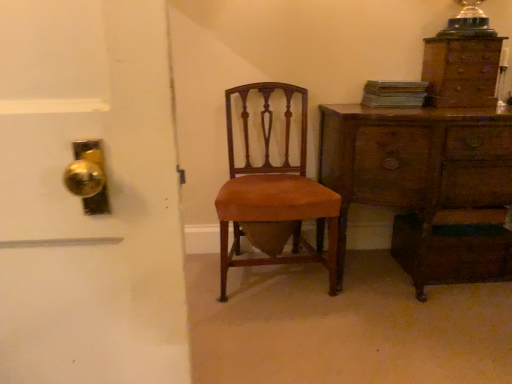
You are a GUI agent. You are given a task and a screenshot of the screen. Output one action in this format:
    pyautogui.click(x=<x>, y=<y>)
    Task: Click on the wooden chest of drawers at right, placed as the second chest of drawers when sorted from top to bottom
    Image resolution: width=512 pixels, height=384 pixels.
    Given the screenshot: What is the action you would take?
    pyautogui.click(x=417, y=167)

Identify the location of brown wood chair at center. (274, 195).

You are a GUI agent. You are given a task and a screenshot of the screen. Output one action in this format:
    pyautogui.click(x=<x>, y=<y>)
    Task: Click on the wooden chest of drawers at upper right, acting as the 2th chest of drawers starting from the bottom
    
    Given the screenshot: What is the action you would take?
    point(461,71)

Is brown wood chair at center oriented away from wooden chest of drawers at right, placed as the second chest of drawers when sorted from top to bottom?

brown wood chair at center is not turned away from wooden chest of drawers at right, placed as the second chest of drawers when sorted from top to bottom.

What's the angular difference between brown wood chair at center and wooden chest of drawers at right, placed as the second chest of drawers when sorted from top to bottom,'s facing directions?

There is a 0.0948-degree angle between the facing directions of brown wood chair at center and wooden chest of drawers at right, placed as the second chest of drawers when sorted from top to bottom.

Which is behind, point (321, 211) or point (374, 147)?

The point (321, 211) is farther.

From the image's perspective, is brown wood chair at center located above or below wooden chest of drawers at right, the first chest of drawers positioned from the bottom?

From the image's perspective, brown wood chair at center appears above wooden chest of drawers at right, the first chest of drawers positioned from the bottom.

How much distance is there between wooden chest of drawers at upper right, acting as the 2th chest of drawers starting from the bottom, and wooden chest of drawers at right, the first chest of drawers positioned from the bottom?

wooden chest of drawers at upper right, acting as the 2th chest of drawers starting from the bottom, is 35.19 centimeters from wooden chest of drawers at right, the first chest of drawers positioned from the bottom.

Is wooden chest of drawers at upper right, acting as the 2th chest of drawers starting from the bottom, positioned with its back to wooden chest of drawers at right, the first chest of drawers positioned from the bottom?

That's not correct — wooden chest of drawers at upper right, acting as the 2th chest of drawers starting from the bottom, is not looking away from wooden chest of drawers at right, the first chest of drawers positioned from the bottom.

Looking at the image, does wooden chest of drawers at upper right, acting as the 2th chest of drawers starting from the bottom, seem bigger or smaller compared to wooden chest of drawers at right, the first chest of drawers positioned from the bottom?

Clearly, wooden chest of drawers at upper right, acting as the 2th chest of drawers starting from the bottom, is smaller in size than wooden chest of drawers at right, the first chest of drawers positioned from the bottom.

Is wooden chest of drawers at upper right, acting as the 2th chest of drawers starting from the bottom, not close to wooden chest of drawers at right, the first chest of drawers positioned from the bottom?

wooden chest of drawers at upper right, acting as the 2th chest of drawers starting from the bottom, is near wooden chest of drawers at right, the first chest of drawers positioned from the bottom, not far away.

Is the depth of brown wood chair at center greater than that of translucent glass lampshade at upper right?

No, it is in front of translucent glass lampshade at upper right.

Is brown wood chair at center wider than translucent glass lampshade at upper right?

Yes.

From the image's perspective, would you say brown wood chair at center is shown under translucent glass lampshade at upper right?

Yes.

What are the coordinates of `table lamp above the brown wood chair at center (from a real-world perspective)` in the screenshot? It's located at (468, 22).

Can you confirm if wooden chest of drawers at right, the first chest of drawers positioned from the bottom, is wider than translucent glass lampshade at upper right?

Indeed, wooden chest of drawers at right, the first chest of drawers positioned from the bottom, has a greater width compared to translucent glass lampshade at upper right.

Is wooden chest of drawers at right, the first chest of drawers positioned from the bottom, oriented towards translucent glass lampshade at upper right?

No.

Does wooden chest of drawers at right, the first chest of drawers positioned from the bottom, have a larger size compared to translucent glass lampshade at upper right?

Yes.

What's the angular difference between wooden chest of drawers at right, placed as the second chest of drawers when sorted from top to bottom, and translucent glass lampshade at upper right's facing directions?

The facing directions of wooden chest of drawers at right, placed as the second chest of drawers when sorted from top to bottom, and translucent glass lampshade at upper right are 1.01 degrees apart.

Is translucent glass lampshade at upper right not inside wooden chest of drawers at upper right, acting as the 2th chest of drawers starting from the bottom?

Yes, translucent glass lampshade at upper right is outside of wooden chest of drawers at upper right, acting as the 2th chest of drawers starting from the bottom.

Considering the sizes of translucent glass lampshade at upper right and wooden chest of drawers at upper right, acting as the 2th chest of drawers starting from the bottom, in the image, is translucent glass lampshade at upper right wider or thinner than wooden chest of drawers at upper right, acting as the 2th chest of drawers starting from the bottom,?

translucent glass lampshade at upper right is thinner than wooden chest of drawers at upper right, acting as the 2th chest of drawers starting from the bottom.

Considering the relative positions of translucent glass lampshade at upper right and wooden chest of drawers at upper right, which appears as the first chest of drawers when viewed from the top, in the image provided, is translucent glass lampshade at upper right to the left of wooden chest of drawers at upper right, which appears as the first chest of drawers when viewed from the top, from the viewer's perspective?

Correct, you'll find translucent glass lampshade at upper right to the left of wooden chest of drawers at upper right, which appears as the first chest of drawers when viewed from the top.

How far apart are brown wood chair at center and wooden chest of drawers at upper right, acting as the 2th chest of drawers starting from the bottom?

The distance of brown wood chair at center from wooden chest of drawers at upper right, acting as the 2th chest of drawers starting from the bottom, is 82.13 centimeters.

Is brown wood chair at center inside the boundaries of wooden chest of drawers at upper right, acting as the 2th chest of drawers starting from the bottom, or outside?

brown wood chair at center is not inside wooden chest of drawers at upper right, acting as the 2th chest of drawers starting from the bottom, it's outside.

From a real-world perspective, is brown wood chair at center positioned under wooden chest of drawers at upper right, which appears as the first chest of drawers when viewed from the top, based on gravity?

Yes, from a real-world perspective, brown wood chair at center is below wooden chest of drawers at upper right, which appears as the first chest of drawers when viewed from the top.

From the brown wood chair at center, count 2nd chest of drawers to the right and point to it. Please provide its 2D coordinates.

[(461, 71)]

From the image's perspective, is wooden chest of drawers at upper right, acting as the 2th chest of drawers starting from the bottom, on brown wood chair at center?

Yes.

Is wooden chest of drawers at upper right, which appears as the first chest of drawers when viewed from the top, closer to the viewer compared to brown wood chair at center?

No, wooden chest of drawers at upper right, which appears as the first chest of drawers when viewed from the top, is behind brown wood chair at center.

Which of these two, wooden chest of drawers at upper right, which appears as the first chest of drawers when viewed from the top, or brown wood chair at center, is smaller?

Smaller between the two is wooden chest of drawers at upper right, which appears as the first chest of drawers when viewed from the top.

From the picture: Is brown wood chair at center at the back of wooden chest of drawers at upper right, which appears as the first chest of drawers when viewed from the top?

No, wooden chest of drawers at upper right, which appears as the first chest of drawers when viewed from the top,'s orientation is not away from brown wood chair at center.

Where is `chest of drawers below the brown wood chair at center (from a real-world perspective)`? The image size is (512, 384). chest of drawers below the brown wood chair at center (from a real-world perspective) is located at coordinates (417, 167).

This screenshot has height=384, width=512. Identify the location of chest of drawers above the wooden chest of drawers at right, placed as the second chest of drawers when sorted from top to bottom (from the image's perspective). (461, 71).

Estimate the real-world distances between objects in this image. Which object is closer to wooden chest of drawers at upper right, which appears as the first chest of drawers when viewed from the top, wooden chest of drawers at right, placed as the second chest of drawers when sorted from top to bottom, or brown wood chair at center?

wooden chest of drawers at right, placed as the second chest of drawers when sorted from top to bottom, lies closer to wooden chest of drawers at upper right, which appears as the first chest of drawers when viewed from the top, than the other object.

When comparing their distances from wooden chest of drawers at right, the first chest of drawers positioned from the bottom, does brown wood chair at center or translucent glass lampshade at upper right seem closer?

The object closer to wooden chest of drawers at right, the first chest of drawers positioned from the bottom, is brown wood chair at center.

Looking at the image, which one is located further to wooden chest of drawers at right, the first chest of drawers positioned from the bottom, brown wood chair at center or wooden chest of drawers at upper right, which appears as the first chest of drawers when viewed from the top?

wooden chest of drawers at upper right, which appears as the first chest of drawers when viewed from the top, is further to wooden chest of drawers at right, the first chest of drawers positioned from the bottom.

Which object lies further to the anchor point wooden chest of drawers at right, placed as the second chest of drawers when sorted from top to bottom, wooden chest of drawers at upper right, which appears as the first chest of drawers when viewed from the top, or translucent glass lampshade at upper right?

Among the two, translucent glass lampshade at upper right is located further to wooden chest of drawers at right, placed as the second chest of drawers when sorted from top to bottom.

Looking at the image, which one is located closer to translucent glass lampshade at upper right, wooden chest of drawers at right, placed as the second chest of drawers when sorted from top to bottom, or wooden chest of drawers at upper right, acting as the 2th chest of drawers starting from the bottom?

wooden chest of drawers at upper right, acting as the 2th chest of drawers starting from the bottom.

From the image, which object appears to be nearer to wooden chest of drawers at upper right, which appears as the first chest of drawers when viewed from the top, wooden chest of drawers at right, the first chest of drawers positioned from the bottom, or translucent glass lampshade at upper right?

translucent glass lampshade at upper right is closer to wooden chest of drawers at upper right, which appears as the first chest of drawers when viewed from the top.

Looking at the image, which one is located closer to brown wood chair at center, translucent glass lampshade at upper right or wooden chest of drawers at right, placed as the second chest of drawers when sorted from top to bottom?

wooden chest of drawers at right, placed as the second chest of drawers when sorted from top to bottom.

From the image, which object appears to be farther from wooden chest of drawers at right, the first chest of drawers positioned from the bottom, translucent glass lampshade at upper right or wooden chest of drawers at upper right, acting as the 2th chest of drawers starting from the bottom?

translucent glass lampshade at upper right is further to wooden chest of drawers at right, the first chest of drawers positioned from the bottom.

The height and width of the screenshot is (384, 512). Find the location of `table lamp located between brown wood chair at center and wooden chest of drawers at upper right, acting as the 2th chest of drawers starting from the bottom, in the left-right direction`. table lamp located between brown wood chair at center and wooden chest of drawers at upper right, acting as the 2th chest of drawers starting from the bottom, in the left-right direction is located at coordinates (468, 22).

The image size is (512, 384). I want to click on chest of drawers between brown wood chair at center and wooden chest of drawers at upper right, which appears as the first chest of drawers when viewed from the top, from left to right, so click(417, 167).

Identify the location of the chest of drawers situated between brown wood chair at center and translucent glass lampshade at upper right from left to right. (417, 167).

Locate an element on the screen. The height and width of the screenshot is (384, 512). chest of drawers between translucent glass lampshade at upper right and wooden chest of drawers at right, placed as the second chest of drawers when sorted from top to bottom, in the up-down direction is located at coordinates (461, 71).